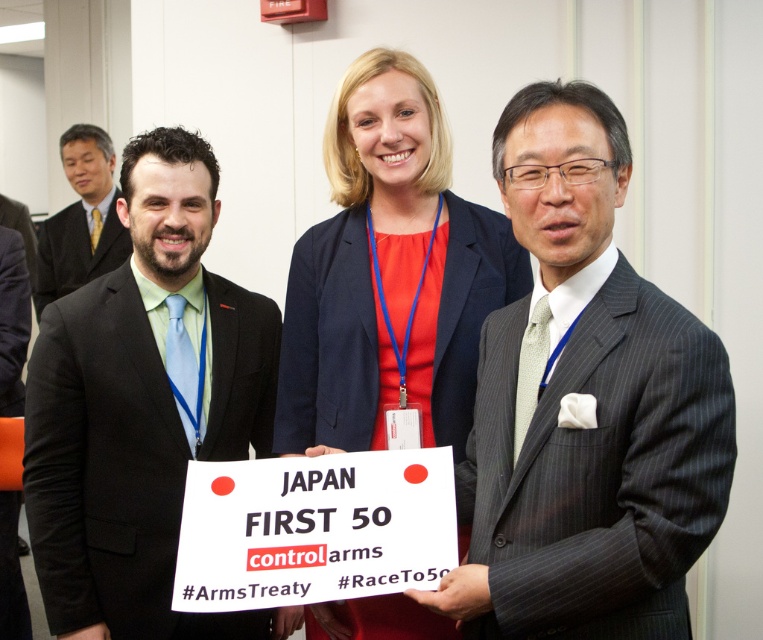
You are organizing a photo shoot and need to arrange two suits in the background. The gray pinstripe suit at right and the matte black suit at left must be placed according to their sizes. Which suit should you place closer to the camera to make them appear the same size?

The gray pinstripe suit at right occupies less space than the matte black suit at left. To make them appear the same size, place the gray pinstripe suit at right closer to the camera than the matte black suit at left.

You are standing at the origin point of the coordinate system in the image. There is a black suit at left located at point (143, 406). Can you tell me the coordinates of the black suit at left?

The coordinates of the black suit at left are point (143, 406).